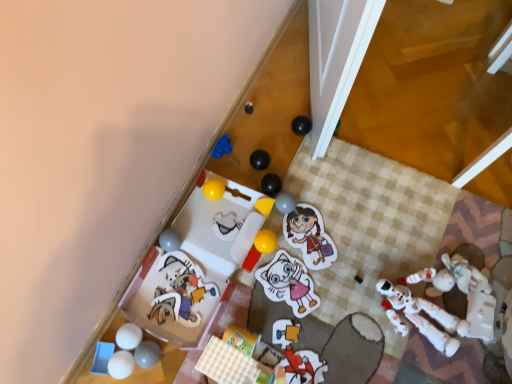
I want to click on free space in front of yellow matte block at upper center, placed as the 11th toy when sorted from left to right, so click(x=258, y=259).